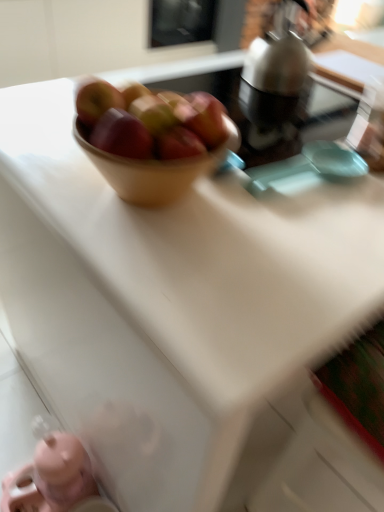
Locate an element on the screen. satin silver coffeepot at upper right is located at coordinates (279, 75).

Describe the element at coordinates (279, 75) in the screenshot. This screenshot has height=512, width=384. I see `satin silver coffeepot at upper right` at that location.

Where is `satin silver coffeepot at upper right`? satin silver coffeepot at upper right is located at coordinates (279, 75).